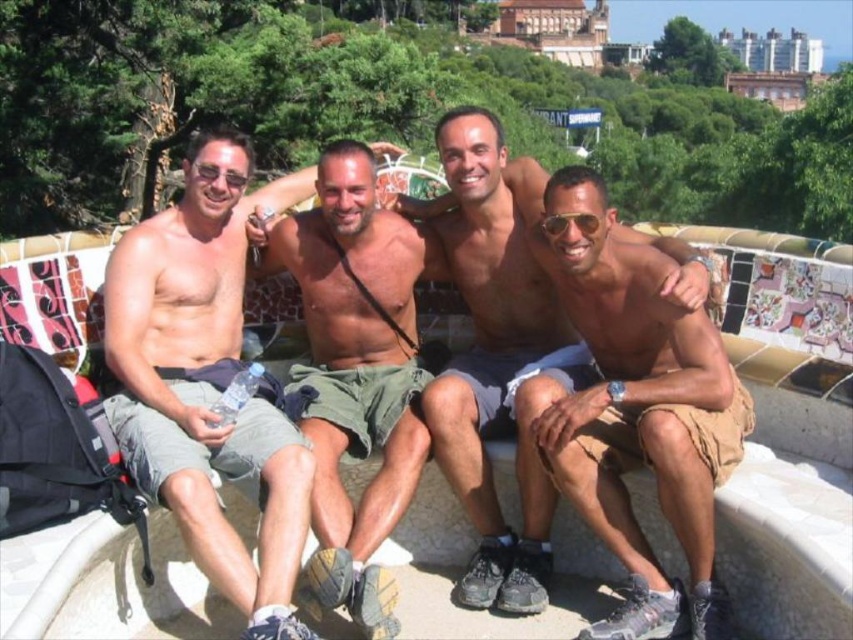
Looking at this image, you are a photographer standing at the camera position. You want to take a closeup shot of the tan fabric shorts at right. Considering the distance, is it possible to capture the shorts clearly without moving closer?

The tan fabric shorts at right is 23.18 meters away from camera. At this distance, capturing a clear closeup shot without moving closer would be challenging unless using a telephoto lens with sufficient zoom capability.

You are a photographer trying to capture the men sitting on the white mosaic bench at center and wearing the green cotton shorts at center. Which object is closer to the camera?

The green cotton shorts at center are closer to the camera because the white mosaic bench at center is positioned under them, indicating the shorts are in front.

You are a photographer standing 10 feet away from the tan fabric shorts at right and the matte khaki shorts at center. You want to capture both pairs of shorts in a single photo without moving your camera. Can you do it?

The tan fabric shorts at right and matte khaki shorts at center are 8.35 feet apart. Since you are standing 10 feet away from both, the distance between them is less than your distance from them, so they can fit within the camera frame without moving.